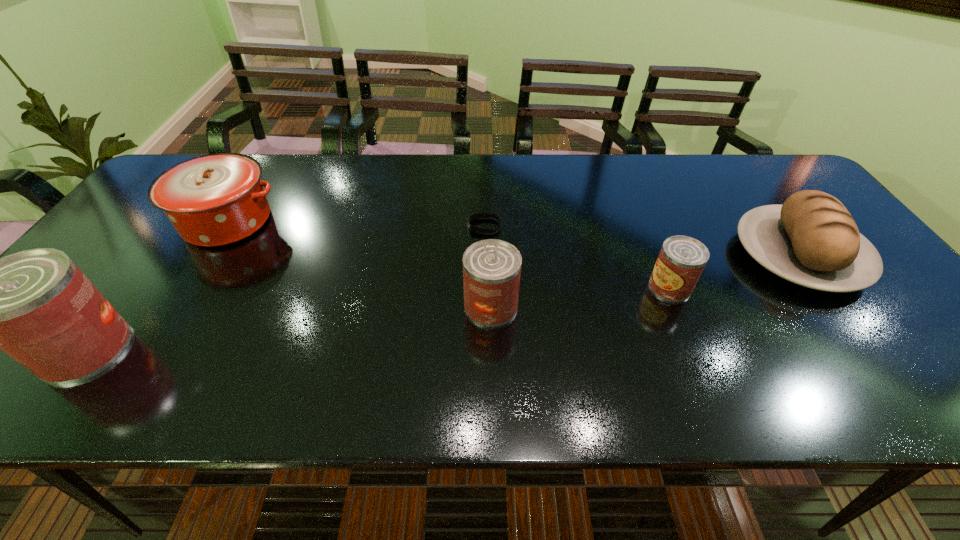
Where is `vacant point located on the right of the rightmost can`? vacant point located on the right of the rightmost can is located at coordinates (787, 287).

Find the location of a particular element. blank area located 0.080m on the right of the casserole is located at coordinates (311, 221).

The image size is (960, 540). Find the location of `free space located on the display of the shortest object`. free space located on the display of the shortest object is located at coordinates pyautogui.click(x=350, y=226).

The image size is (960, 540). Find the location of `free location located on the display of the shortest object`. free location located on the display of the shortest object is located at coordinates (372, 226).

Find the location of `free space located on the display of the shortest object`. free space located on the display of the shortest object is located at coordinates (365, 226).

Find the location of a particular element. free region located on the front of the rightmost object is located at coordinates (874, 359).

Locate an element on the screen. Image resolution: width=960 pixels, height=540 pixels. object positioned at the far edge is located at coordinates (213, 200).

Locate an element on the screen. This screenshot has width=960, height=540. object present at the near edge is located at coordinates (36, 305).

I want to click on can present at the left edge, so 36,305.

Identify the location of casserole located at the left edge. (213, 200).